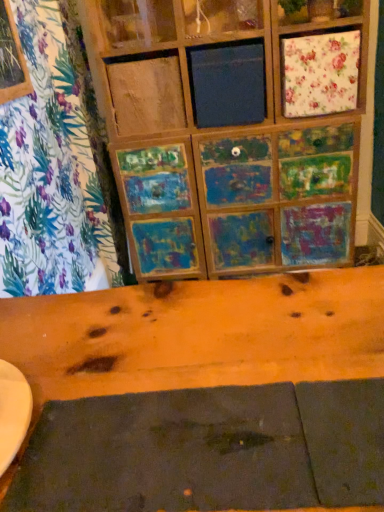
The width and height of the screenshot is (384, 512). In order to click on dark matte placemat at lower center in this screenshot , I will do `click(167, 453)`.

Image resolution: width=384 pixels, height=512 pixels. Describe the element at coordinates (167, 453) in the screenshot. I see `dark matte placemat at lower center` at that location.

The width and height of the screenshot is (384, 512). What do you see at coordinates (319, 73) in the screenshot?
I see `floral fabric cushion at upper right` at bounding box center [319, 73].

Find the location of a particular element. The width and height of the screenshot is (384, 512). floral fabric cushion at upper right is located at coordinates (319, 73).

In order to face floral fabric cushion at upper right, should I rotate leftwards or rightwards?

A 16.002 degree turn to the right will do.

The width and height of the screenshot is (384, 512). What are the coordinates of `dark matte placemat at lower center` in the screenshot? It's located at (167, 453).

Which object is positioned more to the right, floral fabric cushion at upper right or dark matte placemat at lower center?

floral fabric cushion at upper right is more to the right.

Between floral fabric cushion at upper right and dark matte placemat at lower center, which one is positioned in front?

dark matte placemat at lower center.

Between point (338, 64) and point (228, 486), which one is positioned behind?

The point (338, 64) is behind.

From the image's perspective, which is below, floral fabric cushion at upper right or dark matte placemat at lower center?

dark matte placemat at lower center.

From a real-world perspective, does floral fabric cushion at upper right sit lower than dark matte placemat at lower center?

Actually, floral fabric cushion at upper right is physically above dark matte placemat at lower center in the real world.

Looking at their sizes, would you say floral fabric cushion at upper right is wider or thinner than dark matte placemat at lower center?

Clearly, floral fabric cushion at upper right has less width compared to dark matte placemat at lower center.

Is floral fabric cushion at upper right shorter than dark matte placemat at lower center?

Incorrect, the height of floral fabric cushion at upper right does not fall short of that of dark matte placemat at lower center.

Based on their sizes in the image, would you say floral fabric cushion at upper right is bigger or smaller than dark matte placemat at lower center?

In the image, floral fabric cushion at upper right appears to be larger than dark matte placemat at lower center.

Could dark matte placemat at lower center be considered to be inside floral fabric cushion at upper right?

That's incorrect, dark matte placemat at lower center is not inside floral fabric cushion at upper right.

Is floral fabric cushion at upper right next to dark matte placemat at lower center?

They are not placed beside each other.

Is floral fabric cushion at upper right facing towards dark matte placemat at lower center?

Yes, floral fabric cushion at upper right is turned towards dark matte placemat at lower center.

Can you tell me how much floral fabric cushion at upper right and dark matte placemat at lower center differ in facing direction?

93 degrees separate the facing orientations of floral fabric cushion at upper right and dark matte placemat at lower center.

How much distance is there between floral fabric cushion at upper right and dark matte placemat at lower center?

5.64 feet.

This screenshot has width=384, height=512. Find the location of `cabinetry on the right of dark matte placemat at lower center`. cabinetry on the right of dark matte placemat at lower center is located at coordinates (319, 73).

Is dark matte placemat at lower center to the left of floral fabric cushion at upper right from the viewer's perspective?

Yes, dark matte placemat at lower center is to the left of floral fabric cushion at upper right.

Based on the photo, considering the positions of objects dark matte placemat at lower center and floral fabric cushion at upper right in the image provided, who is in front, dark matte placemat at lower center or floral fabric cushion at upper right?

dark matte placemat at lower center is closer to the camera.

Considering the points (192, 475) and (290, 42), which point is in front, point (192, 475) or point (290, 42)?

Point (192, 475)

From the image's perspective, is dark matte placemat at lower center above or below floral fabric cushion at upper right?

Based on their image positions, dark matte placemat at lower center is located beneath floral fabric cushion at upper right.

From a real-world perspective, who is located lower, dark matte placemat at lower center or floral fabric cushion at upper right?

dark matte placemat at lower center is physically lower.

Between dark matte placemat at lower center and floral fabric cushion at upper right, which one has larger width?

dark matte placemat at lower center is wider.

Is dark matte placemat at lower center taller or shorter than floral fabric cushion at upper right?

In the image, dark matte placemat at lower center appears to be shorter than floral fabric cushion at upper right.

Which of these two, dark matte placemat at lower center or floral fabric cushion at upper right, is smaller?

With smaller size is dark matte placemat at lower center.

Is dark matte placemat at lower center located outside floral fabric cushion at upper right?

Yes, dark matte placemat at lower center is outside of floral fabric cushion at upper right.

In the scene shown: Is dark matte placemat at lower center not near floral fabric cushion at upper right?

Indeed, dark matte placemat at lower center is not near floral fabric cushion at upper right.

Does dark matte placemat at lower center turn towards floral fabric cushion at upper right?

No.

Measure the distance from dark matte placemat at lower center to floral fabric cushion at upper right.

dark matte placemat at lower center and floral fabric cushion at upper right are 1.72 meters apart from each other.

Locate an element on the screen. cabinetry above the dark matte placemat at lower center (from a real-world perspective) is located at coordinates (319, 73).

You are a GUI agent. You are given a task and a screenshot of the screen. Output one action in this format:
    pyautogui.click(x=<x>, y=<y>)
    Task: Click on the plank below the floral fabric cushion at upper right (from a real-world perspective)
    This screenshot has height=512, width=384.
    Given the screenshot: What is the action you would take?
    pyautogui.click(x=167, y=453)

What are the coordinates of `cabinetry located above the dark matte placemat at lower center (from a real-world perspective)` in the screenshot? It's located at (319, 73).